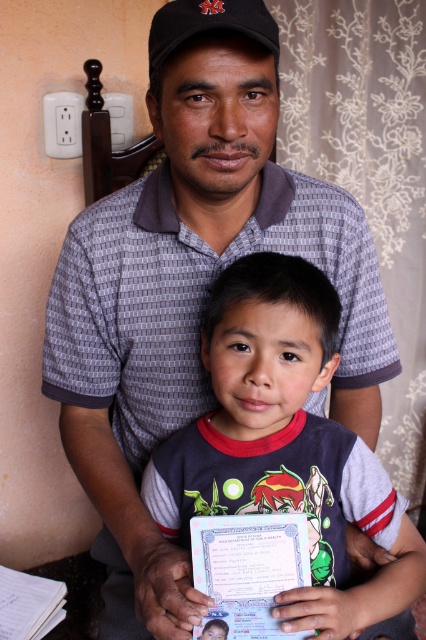
Between point (232, 404) and point (256, 0), which one is positioned in front?

Point (256, 0) is in front.

Which is more to the left, dark gray cotton shirt at center or black matte baseball cap at upper center?

From the viewer's perspective, black matte baseball cap at upper center appears more on the left side.

This screenshot has height=640, width=426. What do you see at coordinates (285, 445) in the screenshot? I see `dark gray cotton shirt at center` at bounding box center [285, 445].

Where is `dark gray cotton shirt at center`? dark gray cotton shirt at center is located at coordinates (285, 445).